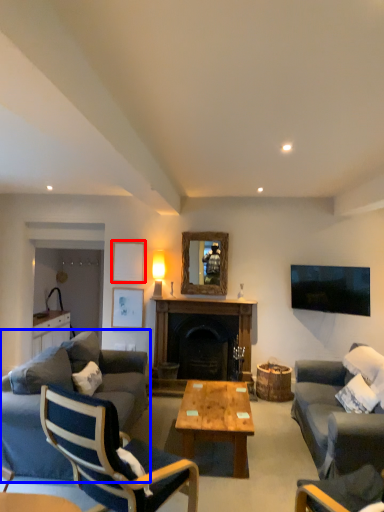
Question: Which point is closer to the camera, picture frame (highlighted by a red box) or studio couch (highlighted by a blue box)?

Choices:
 (A) picture frame
 (B) studio couch

Answer: (B)